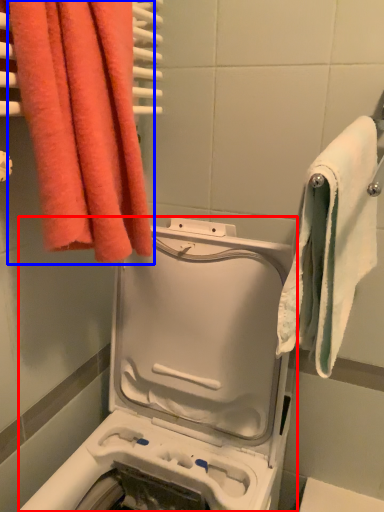
Question: Which of the following is the farthest to the observer, washing machine (highlighted by a red box) or towel (highlighted by a blue box)?

Choices:
 (A) washing machine
 (B) towel

Answer: (B)